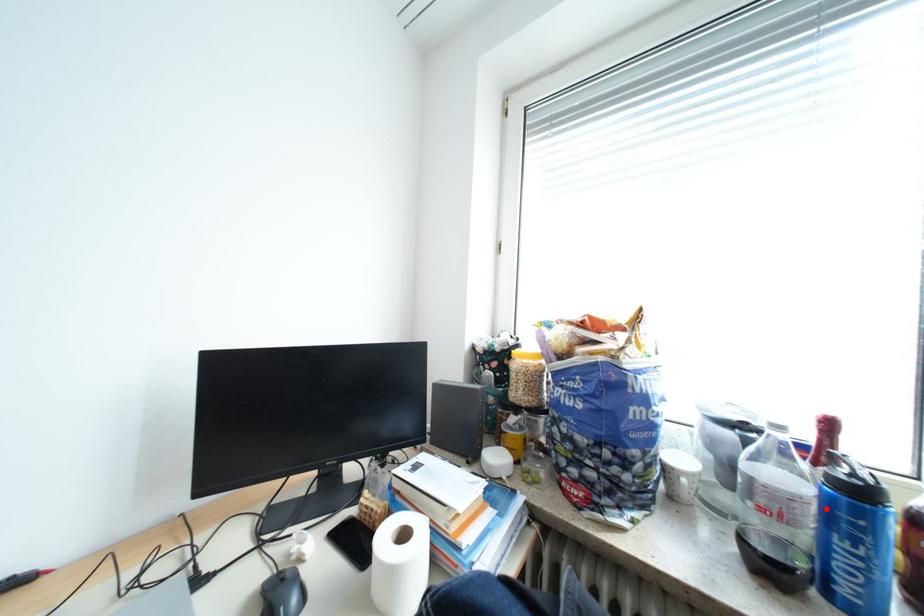
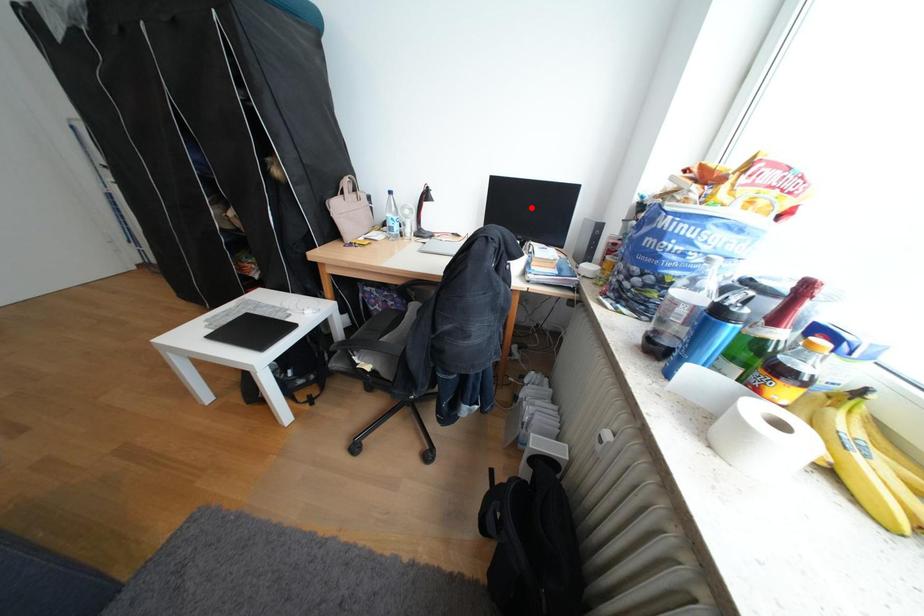
I am providing you with two images of the same scene from different viewpoints. A red point is marked on the first image and another point is marked on the second image. Is the red point in image1 aligned with the point shown in image2?

No